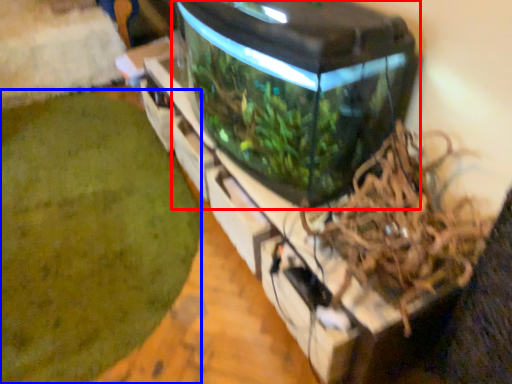
Question: Which object is further to the camera taking this photo, water tank (highlighted by a red box) or debris (highlighted by a blue box)?

Choices:
 (A) water tank
 (B) debris

Answer: (B)